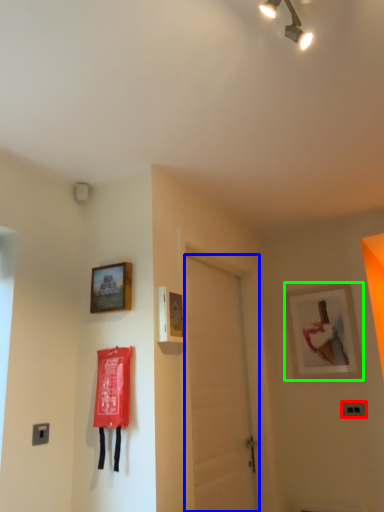
Question: Which object is positioned closest to light switch (highlighted by a red box)? Select from door (highlighted by a blue box) and picture frame (highlighted by a green box).

Choices:
 (A) door
 (B) picture frame

Answer: (B)